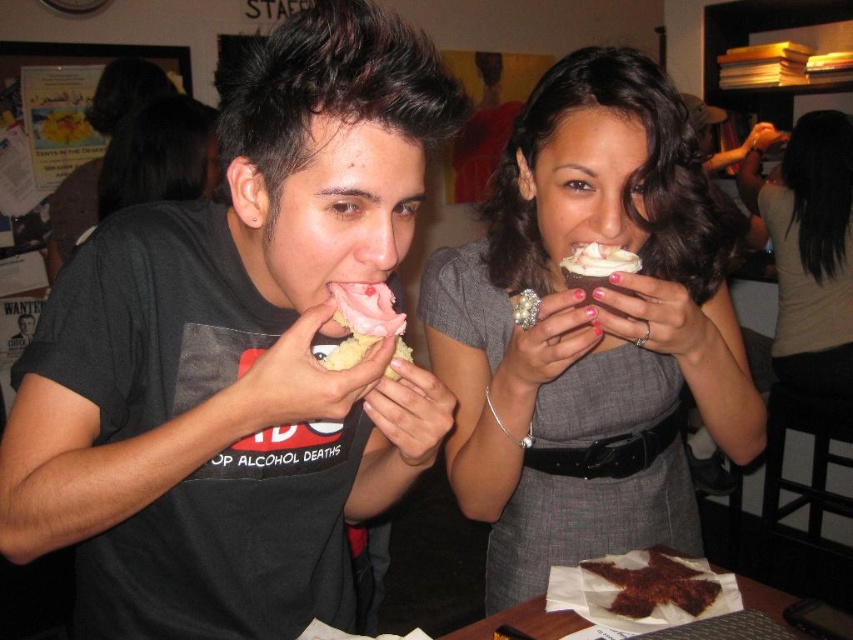
Question: Can you confirm if matte gray dress at center is positioned to the left of white creamy frosting at center?

Choices:
 (A) no
 (B) yes

Answer: (A)

Question: Which object is closer to the camera taking this photo?

Choices:
 (A) matte gray dress at center
 (B) matte black shirt at center
 (C) pink frosting cupcake at center
 (D) white frosted cupcake at center

Answer: (B)

Question: Where is matte gray dress at center located in relation to pink frosting cupcake at center in the image?

Choices:
 (A) left
 (B) right

Answer: (B)

Question: Among these objects, which one is nearest to the camera?

Choices:
 (A) matte black shirt at center
 (B) chocolate cake at center
 (C) white creamy frosting at center

Answer: (A)

Question: Which object is positioned farthest from the white creamy frosting at center?

Choices:
 (A) matte black shirt at center
 (B) chocolate cake at center

Answer: (B)

Question: In this image, where is matte gray dress at center located relative to chocolate cake at center?

Choices:
 (A) left
 (B) right

Answer: (A)